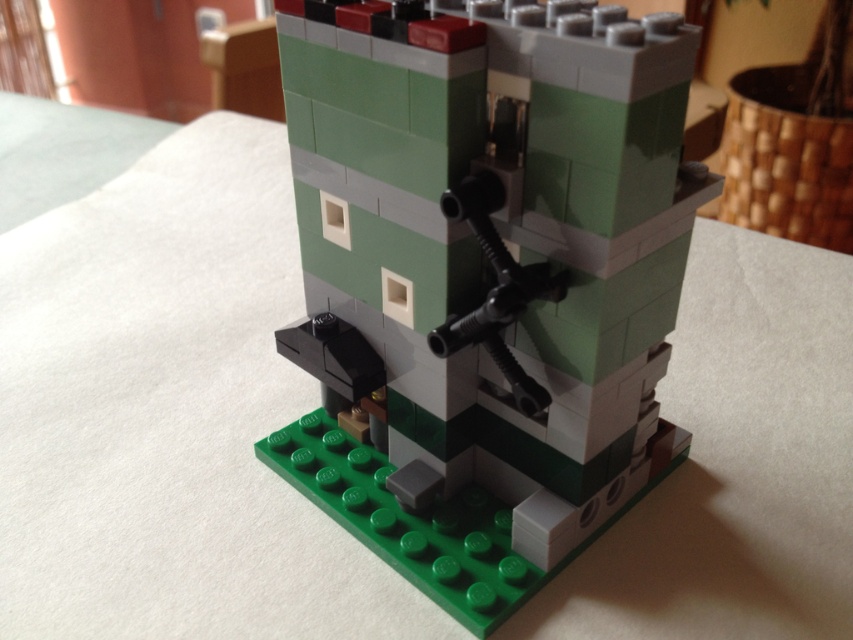
You are examining a LEGO tower and notice two points marked on it. The first point is at coordinates point (664, 120), and the second is at point (514, 388). From your perspective, which point is closer to you?

Point (664, 120) is closer to the viewer than point (514, 388).

You are a toy collector who wants to display both the green matte tower at center and the black plastic gun at center on a shelf. If the shelf has a maximum weight capacity of 5 kilograms, and the tower weighs 3 kilograms while the gun weighs 1 kilogram, will both items fit within the weight limit?

The green matte tower at center weighs 3 kilograms and the black plastic gun at center weighs 1 kilogram. Combined, they total 4 kilograms, which is under the 5 kilogram limit. Both items can be safely placed on the shelf together.